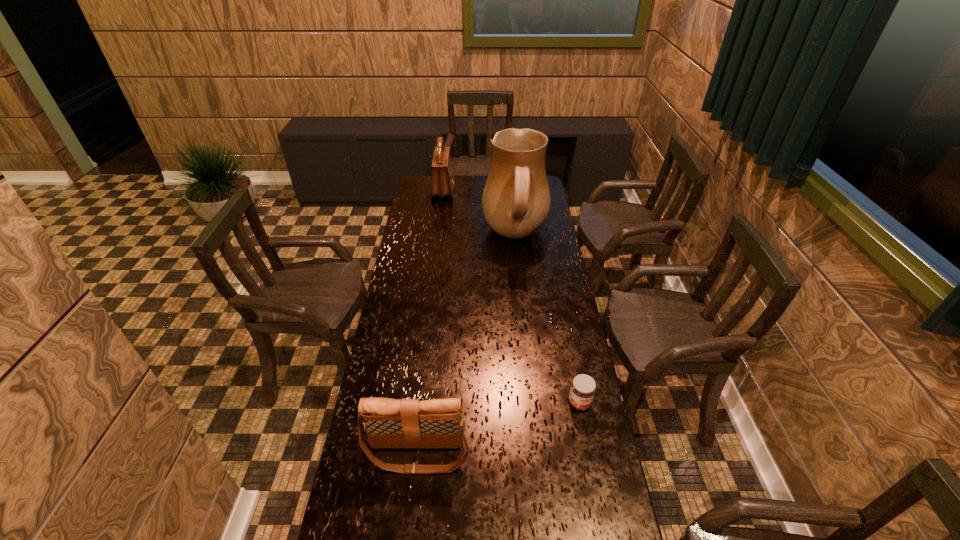
This screenshot has height=540, width=960. What are the coordinates of `unoccupied area between the cream pitcher and the nearest object` in the screenshot? It's located at (467, 345).

Where is `free space between the third nearest object and the shorter shoulder bag`? free space between the third nearest object and the shorter shoulder bag is located at coordinates (467, 345).

Where is `vacant region between the nearer shoulder bag and the cream pitcher`? vacant region between the nearer shoulder bag and the cream pitcher is located at coordinates (467, 345).

Identify the location of free spot between the cream pitcher and the shorter shoulder bag. (x=467, y=345).

Identify the location of empty location between the shorter shoulder bag and the cream pitcher. Image resolution: width=960 pixels, height=540 pixels. (467, 345).

Image resolution: width=960 pixels, height=540 pixels. Identify the location of free space between the taller shoulder bag and the tallest object. (479, 213).

What are the coordinates of `free space between the second nearest object and the nearer shoulder bag` in the screenshot? It's located at (498, 428).

Find the location of a particular element. This screenshot has width=960, height=540. free area in between the second tallest object and the nearest object is located at coordinates (430, 322).

The width and height of the screenshot is (960, 540). Find the location of `vacant point located between the second shortest object and the shortest object`. vacant point located between the second shortest object and the shortest object is located at coordinates (498, 428).

Find the location of a particular element. This screenshot has width=960, height=540. vacant region between the shortest object and the tallest object is located at coordinates (547, 320).